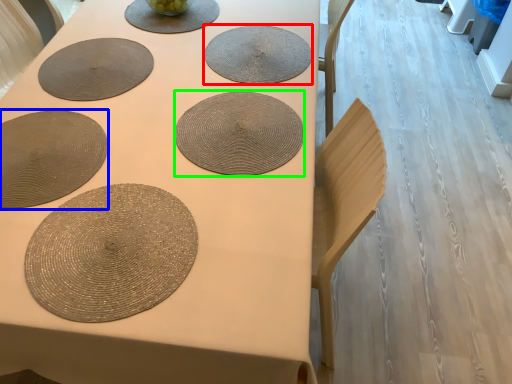
Question: Which object is the farthest from coaster (highlighted by a red box)? Choose among these: paper plate (highlighted by a blue box) or coaster (highlighted by a green box).

Choices:
 (A) paper plate
 (B) coaster

Answer: (A)